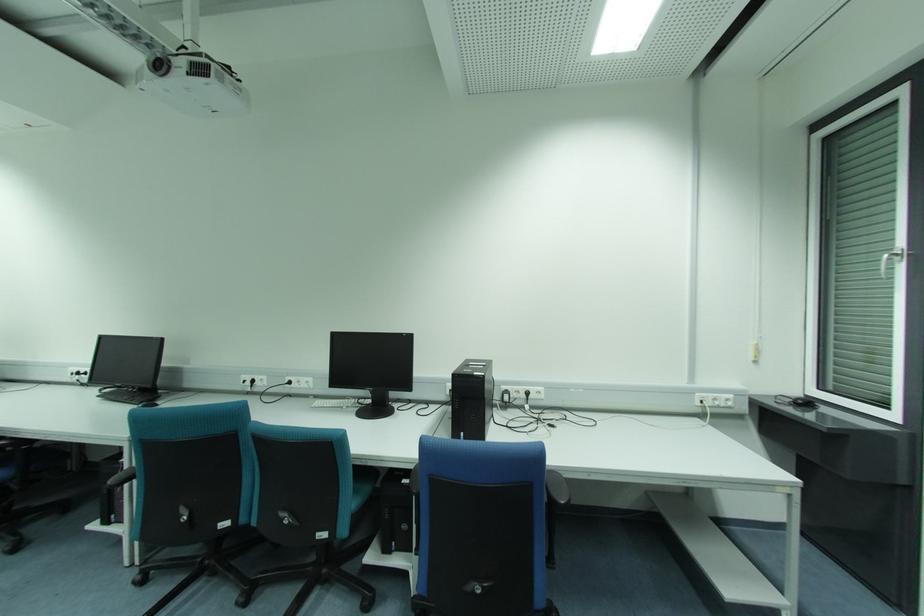
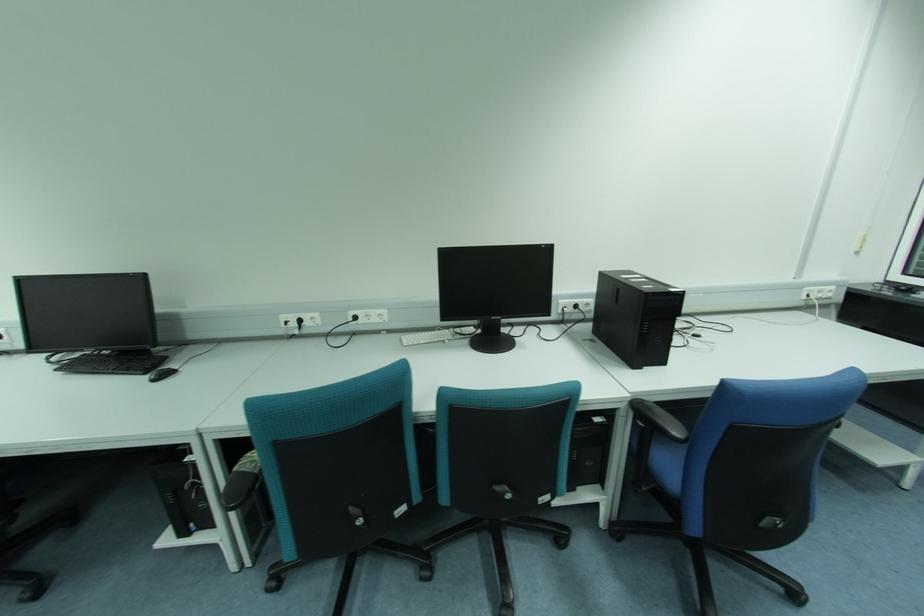
What movement of the cameraman would produce the second image?

The movement direction of the cameraman is left, forward.